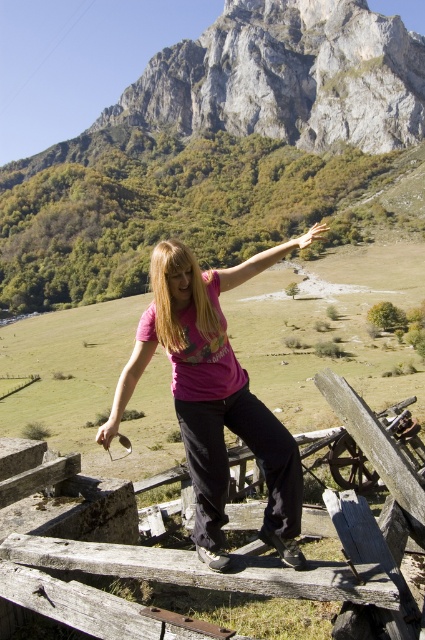
Is weathered wood fence at center to the left of pink matte shirt at center from the viewer's perspective?

No, weathered wood fence at center is not to the left of pink matte shirt at center.

What do you see at coordinates (212, 577) in the screenshot? I see `weathered wood fence at center` at bounding box center [212, 577].

Identify the location of weathered wood fence at center. (x=212, y=577).